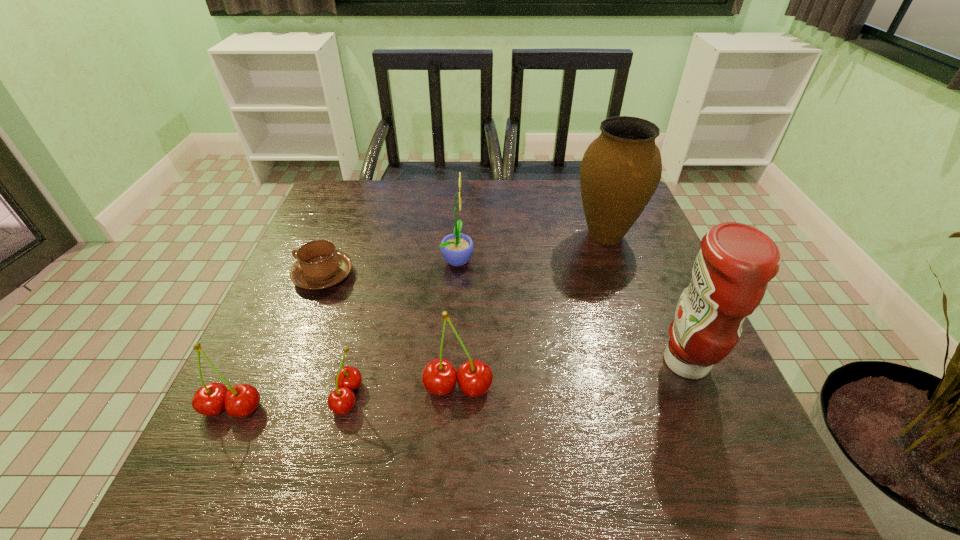
Please point a free position for a cherry on the right. Please provide its 2D coordinates. Your answer should be formatted as a tuple, i.e. [(x, y)], where the tuple contains the x and y coordinates of a point satisfying the conditions above.

[(564, 377)]